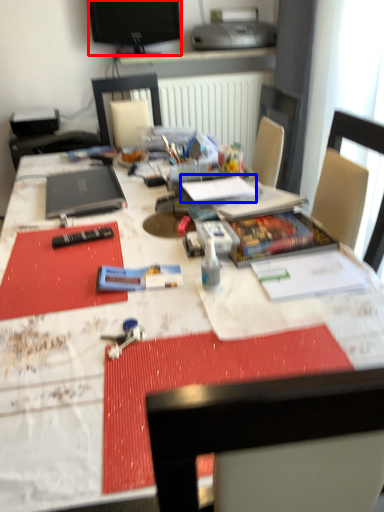
Question: Which object is further to the camera taking this photo, television (highlighted by a red box) or notebook (highlighted by a blue box)?

Choices:
 (A) television
 (B) notebook

Answer: (A)